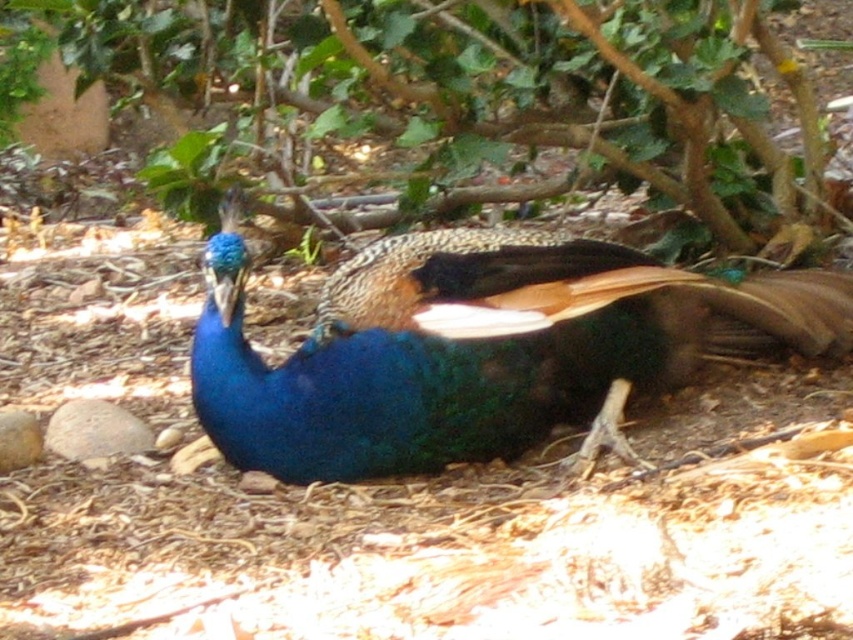
Question: Which point is farther from the camera taking this photo?

Choices:
 (A) (239, 364)
 (B) (55, 112)

Answer: (B)

Question: Is green leafy tree at upper center above shiny blue peacock at center?

Choices:
 (A) no
 (B) yes

Answer: (B)

Question: Which object appears closest to the camera in this image?

Choices:
 (A) green leafy tree at upper center
 (B) shiny blue peacock at center

Answer: (B)

Question: Does green leafy tree at upper center appear under shiny blue peacock at center?

Choices:
 (A) yes
 (B) no

Answer: (B)

Question: Is green leafy tree at upper center below shiny blue peacock at center?

Choices:
 (A) yes
 (B) no

Answer: (B)

Question: Which of the following is the closest to the observer?

Choices:
 (A) (345, 317)
 (B) (537, 51)

Answer: (A)